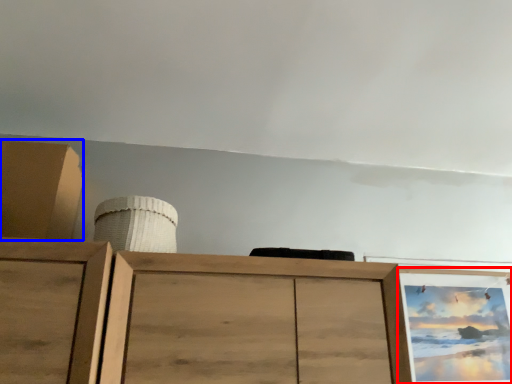
Question: Among these objects, which one is nearest to the camera, picture frame (highlighted by a red box) or cabinetry (highlighted by a blue box)?

Choices:
 (A) picture frame
 (B) cabinetry

Answer: (B)